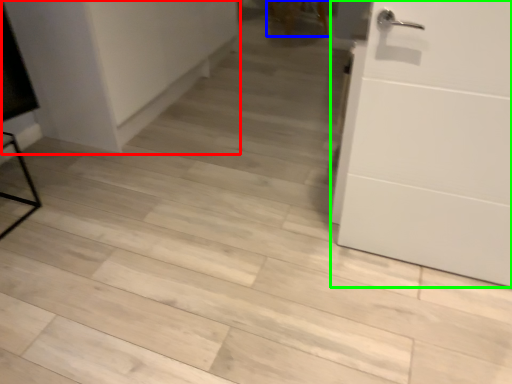
Question: Based on their relative distances, which object is farther from cabinetry (highlighted by a red box)? Choose from chair (highlighted by a blue box) and door (highlighted by a green box).

Choices:
 (A) chair
 (B) door

Answer: (A)